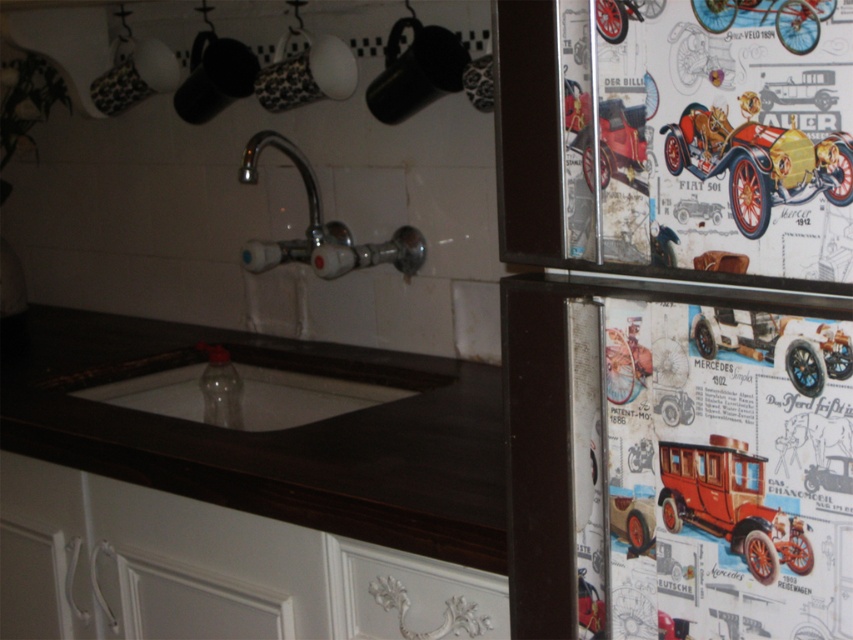
Can you confirm if chrome/polished metal faucet at upper center is taller than metallic bicycle at upper right?

Yes.

The image size is (853, 640). Find the location of `chrome/polished metal faucet at upper center`. chrome/polished metal faucet at upper center is located at coordinates (322, 227).

Between point (347, 234) and point (781, 19), which one is positioned behind?

The point (347, 234) is behind.

Find the location of a particular element. This screenshot has height=640, width=853. chrome/polished metal faucet at upper center is located at coordinates (322, 227).

Does metallic vintage car at upper right have a greater width compared to metallic bicycle at upper right?

Yes, metallic vintage car at upper right is wider than metallic bicycle at upper right.

Between metallic vintage car at upper right and metallic bicycle at upper right, which one has less height?

metallic bicycle at upper right

Who is more distant from viewer, (722, 154) or (804, 8)?

Point (722, 154)

You are a GUI agent. You are given a task and a screenshot of the screen. Output one action in this format:
    pyautogui.click(x=<x>, y=<y>)
    Task: Click on the metallic vintage car at upper right
    
    Given the screenshot: What is the action you would take?
    pyautogui.click(x=758, y=161)

Does dark wood countertop at center appear over chrome/polished metal faucet at upper center?

Incorrect, dark wood countertop at center is not positioned above chrome/polished metal faucet at upper center.

Which is more to the left, dark wood countertop at center or chrome/polished metal faucet at upper center?

Positioned to the left is dark wood countertop at center.

Is point (90, 314) positioned after point (285, 252)?

That is True.

Identify the location of dark wood countertop at center. (271, 433).